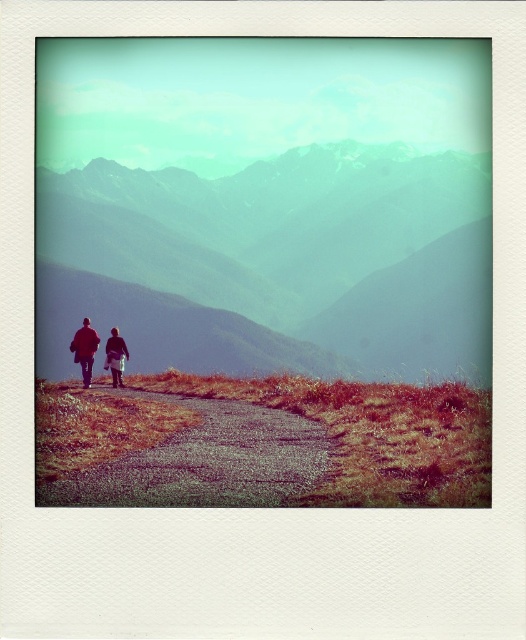
Can you confirm if green textured mountains at upper center is positioned below brown leather jacket at lower left?

Incorrect, green textured mountains at upper center is not positioned below brown leather jacket at lower left.

Can you confirm if green textured mountains at upper center is shorter than brown leather jacket at lower left?

In fact, green textured mountains at upper center may be taller than brown leather jacket at lower left.

Measure the distance between green textured mountains at upper center and camera.

green textured mountains at upper center and camera are 621.78 feet apart.

You are a GUI agent. You are given a task and a screenshot of the screen. Output one action in this format:
    pyautogui.click(x=<x>, y=<y>)
    Task: Click on the green textured mountains at upper center
    The image size is (526, 640).
    Given the screenshot: What is the action you would take?
    pyautogui.click(x=298, y=250)

Is point (76, 360) more distant than point (88, 328)?

Yes, it is.

Locate an element on the screen. This screenshot has height=640, width=526. brown leather jacket at lower left is located at coordinates (85, 349).

Who is lower down, green textured mountains at upper center or red woolen jacket at left?

Positioned lower is red woolen jacket at left.

Is point (199, 321) positioned behind point (88, 376)?

That is True.

Where is `green textured mountains at upper center`? The width and height of the screenshot is (526, 640). green textured mountains at upper center is located at coordinates (298, 250).